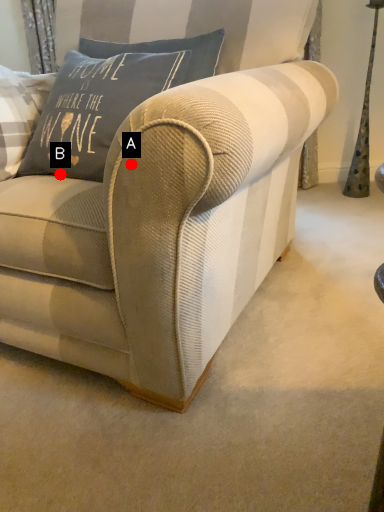
Question: Two points are circled on the image, labeled by A and B beside each circle. Which point is closer to the camera?

Choices:
 (A) A is closer
 (B) B is closer

Answer: (A)